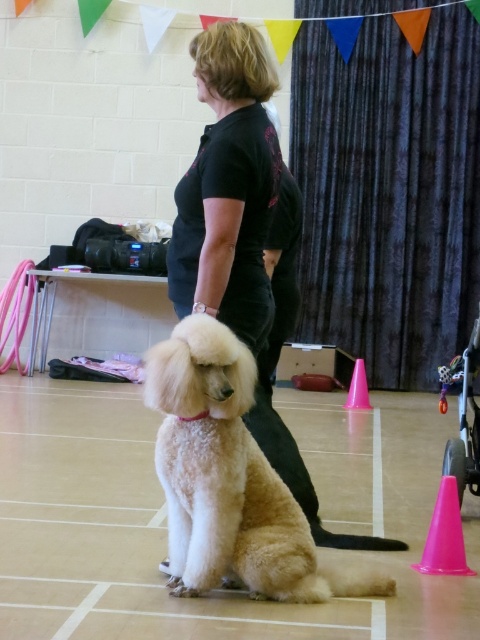
You are a photographer positioned at the front of the gymnasium and need to capture a photo of the black smooth shirt at center. Based on the coordinates provided in the description, where should you aim your camera relative to the poodle?

The black smooth shirt at center is located at point (x=228, y=188), which is to the left and slightly above the poodle. Aim your camera to the left of the poodle and slightly upwards to capture the shirt.

You are standing at the point labeled point (224, 51) and want to walk to the point labeled point (455, 442). According to the scene description, will you pass by the poodle with the red collar during your path?

Yes, because point (224, 51) is in front of point (455, 442), so walking from the first point to the second would require moving towards the back of the scene, likely passing by the poodle which is in the foreground.